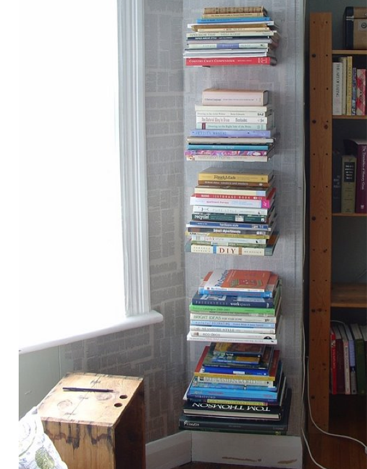
Locate an element on the screen. This screenshot has height=469, width=367. stack of books on shelf above the lowest shelf is located at coordinates (234, 328).